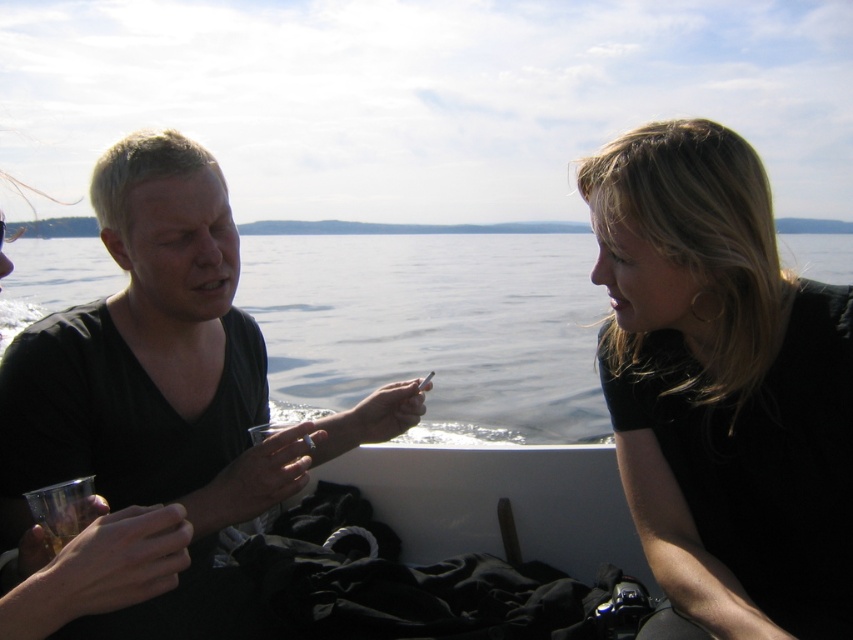
Question: Considering the relative positions of black matte hair at upper right and transparent water at center in the image provided, where is black matte hair at upper right located with respect to transparent water at center?

Choices:
 (A) right
 (B) left

Answer: (B)

Question: Which object appears closest to the camera in this image?

Choices:
 (A) black matte hair at upper right
 (B) transparent water at center

Answer: (A)

Question: Considering the real-world distances, which object is closest to the black matte hair at upper right?

Choices:
 (A) black matte shirt at left
 (B) transparent water at center

Answer: (A)

Question: Does black matte shirt at left have a lesser width compared to transparent water at center?

Choices:
 (A) yes
 (B) no

Answer: (A)

Question: Is black matte shirt at left above transparent water at center?

Choices:
 (A) no
 (B) yes

Answer: (A)

Question: Which of these objects is positioned closest to the black matte shirt at left?

Choices:
 (A) black matte hair at upper right
 (B) transparent water at center

Answer: (A)